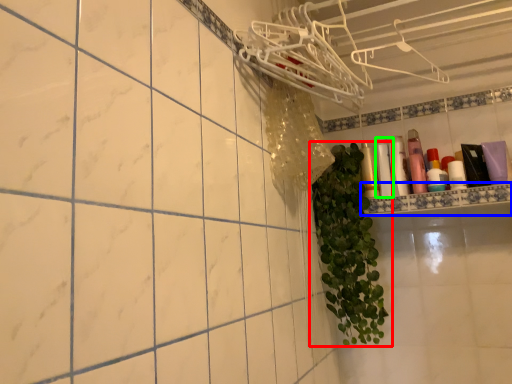
Question: Which object is positioned farthest from houseplant (highlighted by a red box)? Select from ledge (highlighted by a blue box) and toiletry (highlighted by a green box).

Choices:
 (A) ledge
 (B) toiletry

Answer: (B)